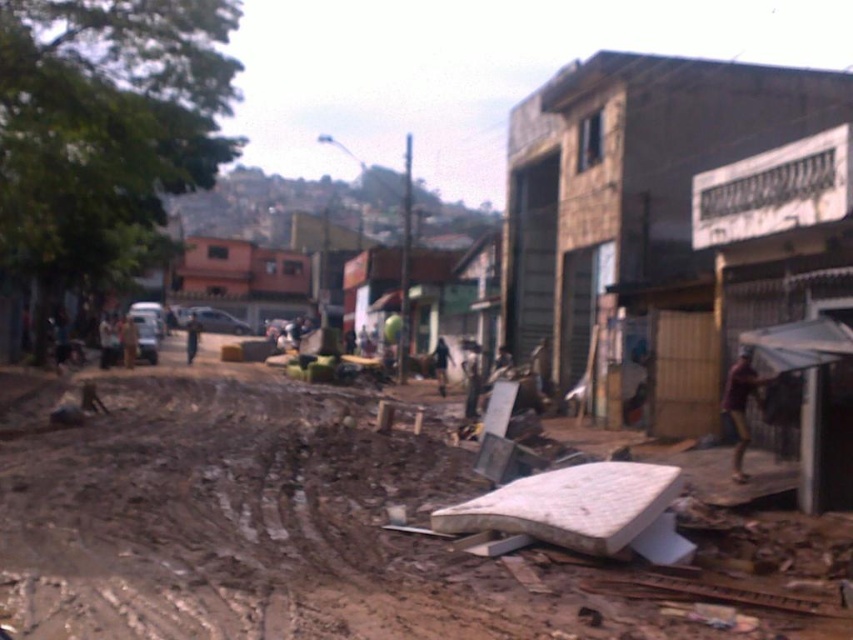
Question: Is brown dirt at lower center positioned at the back of brown fabric shirt at right?

Choices:
 (A) yes
 (B) no

Answer: (B)

Question: Based on their relative distances, which object is nearer to the brown fabric shirt at right?

Choices:
 (A) brown dirt at lower center
 (B) brown leather jacket at center

Answer: (A)

Question: Estimate the real-world distances between objects in this image. Which object is closer to the brown dirt at lower center?

Choices:
 (A) brown fabric shirt at right
 (B) brown leather jacket at center
 (C) dark skin human at center

Answer: (A)

Question: Can you confirm if brown dirt at lower center is smaller than dark skin human at center?

Choices:
 (A) yes
 (B) no

Answer: (B)

Question: Is dark skin human at center in front of brown leather jacket at center?

Choices:
 (A) no
 (B) yes

Answer: (B)

Question: Among these points, which one is nearest to the camera?

Choices:
 (A) (187, 349)
 (B) (431, 353)
 (C) (102, 422)
 (D) (737, 461)

Answer: (D)